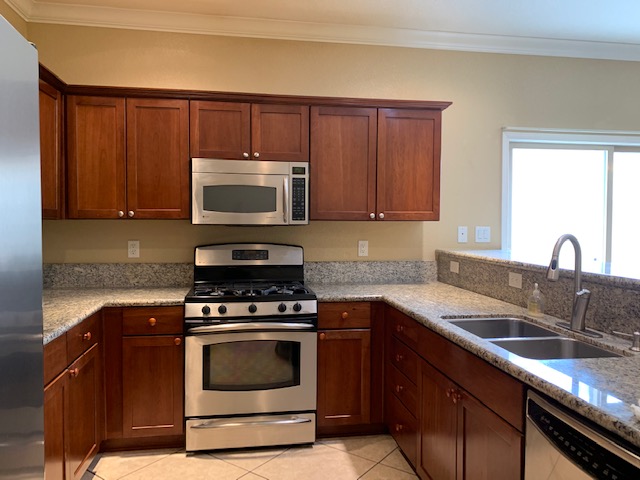
Locate an element on the screen. This screenshot has height=480, width=640. countertop is located at coordinates (444, 296), (331, 287), (154, 290), (56, 307), (614, 371).